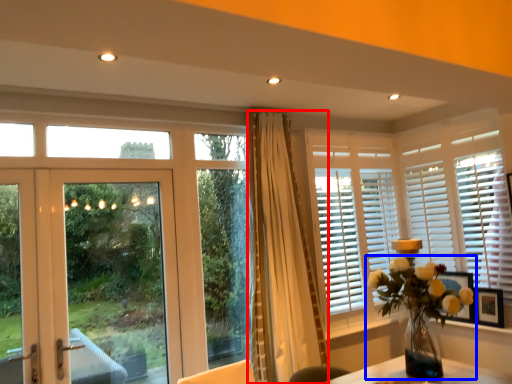
Question: Which of the following is the closest to the observer, curtain (highlighted by a red box) or houseplant (highlighted by a blue box)?

Choices:
 (A) curtain
 (B) houseplant

Answer: (B)